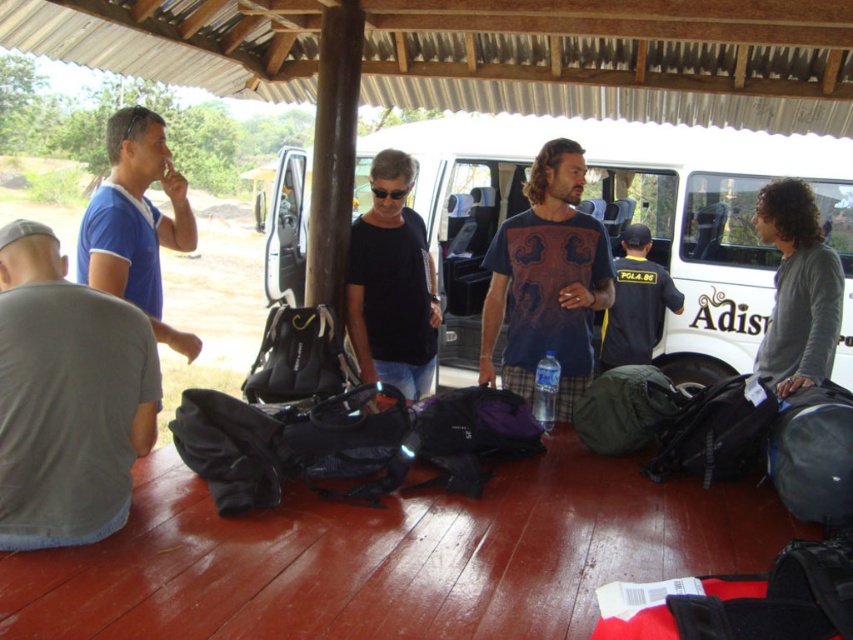
Question: Which object is closer to the camera taking this photo?

Choices:
 (A) dark blue uniform at center
 (B) white matte van at center
 (C) black matte shirt at center

Answer: (C)

Question: Is white matte van at center behind gray cotton shirt at lower left?

Choices:
 (A) yes
 (B) no

Answer: (A)

Question: Does white matte van at center have a greater width compared to dark blue printed t-shirt at center?

Choices:
 (A) no
 (B) yes

Answer: (B)

Question: Can you confirm if dark blue printed t-shirt at center is thinner than matte blue shirt at left?

Choices:
 (A) no
 (B) yes

Answer: (A)

Question: Which is nearer to the white matte van at center?

Choices:
 (A) black matte shirt at center
 (B) dark blue printed t-shirt at center
 (C) gray cotton shirt at lower left

Answer: (A)

Question: Which of the following is the closest to the observer?

Choices:
 (A) (521, 314)
 (B) (625, 326)

Answer: (A)